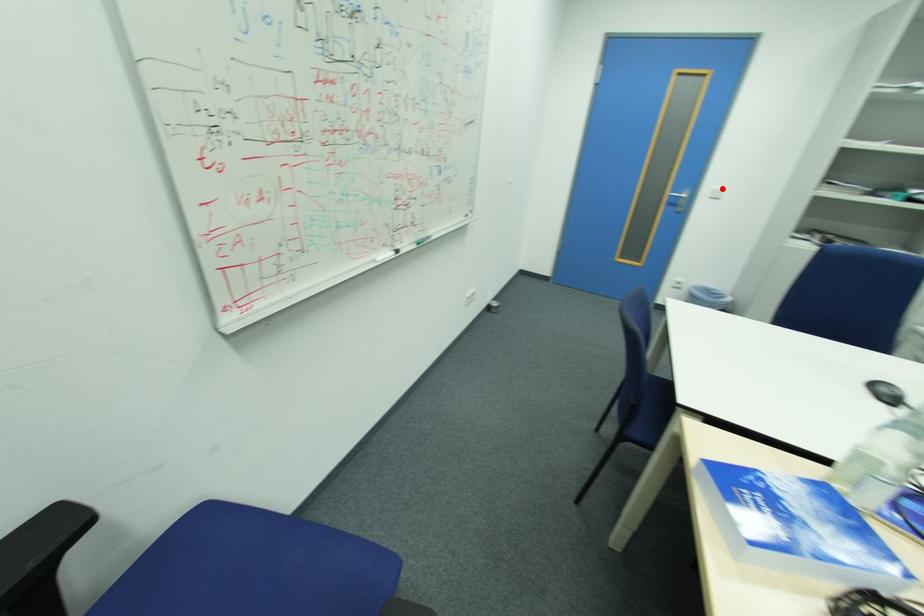
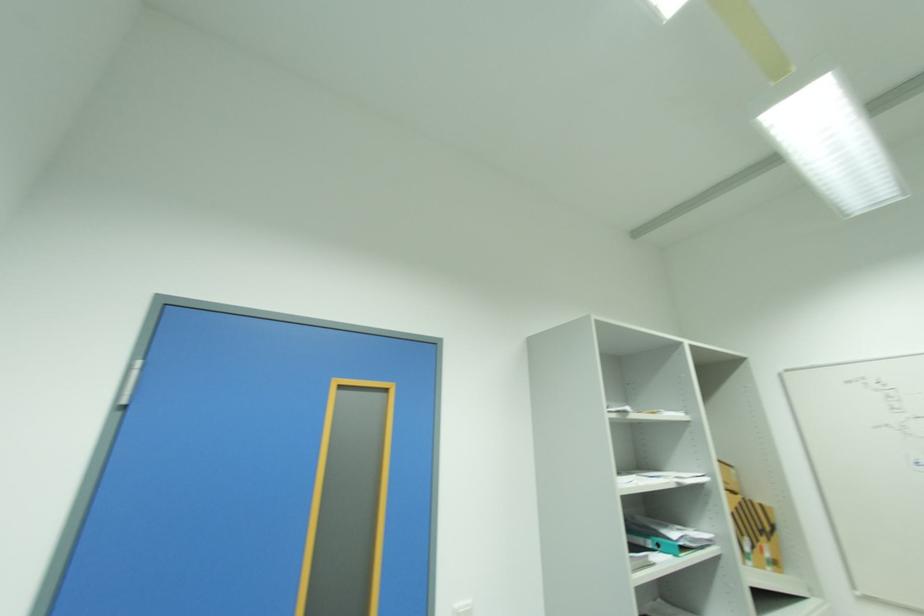
Question: I am providing you with two images of the same scene from different viewpoints. A red point is marked on the first image. At the location where the point appears in image 1, is it still visible in image 2?

Choices:
 (A) Yes
 (B) No

Answer: (A)